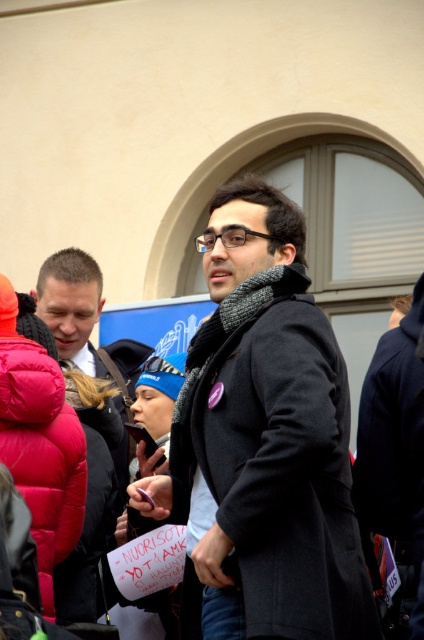
You are a fashion designer observing the scene. You notice the black woolen coat at center and the knitted wool scarf at center. Which item is wider?

The black woolen coat at center is wider than the knitted wool scarf at center because the coat surpasses the scarf in width.

You are standing in front of the beige building with the arched window and see a man in a dark coat holding a small object and a person in a matte pink puffer jacket at left. Based on their positions, which of these two individuals is closer to the left edge of the scene?

The matte pink puffer jacket at left is located at point (39, 444), which means it is closer to the left edge of the scene compared to the man in the dark coat.